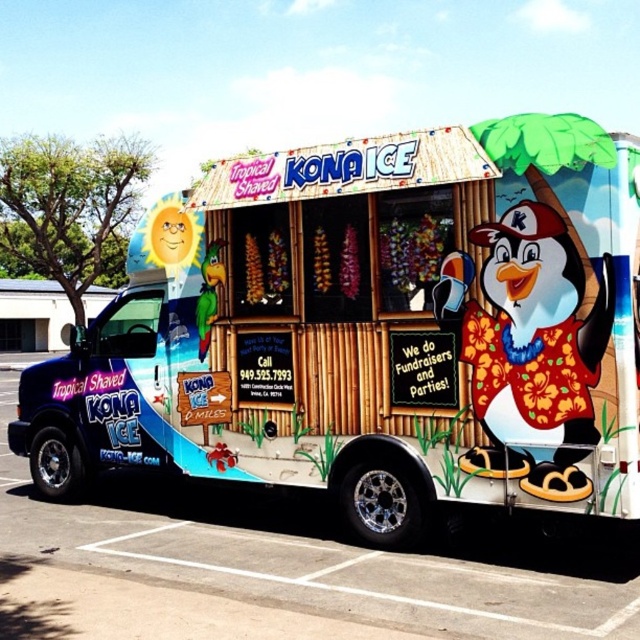
Does matte blue truck at center come behind blue painted asphalt at lower center?

Yes, it is.

Describe the element at coordinates (372, 332) in the screenshot. This screenshot has width=640, height=640. I see `matte blue truck at center` at that location.

At what (x,y) coordinates should I click in order to perform the action: click on matte blue truck at center. Please return your answer as a coordinate pair (x, y). The image size is (640, 640). Looking at the image, I should click on (372, 332).